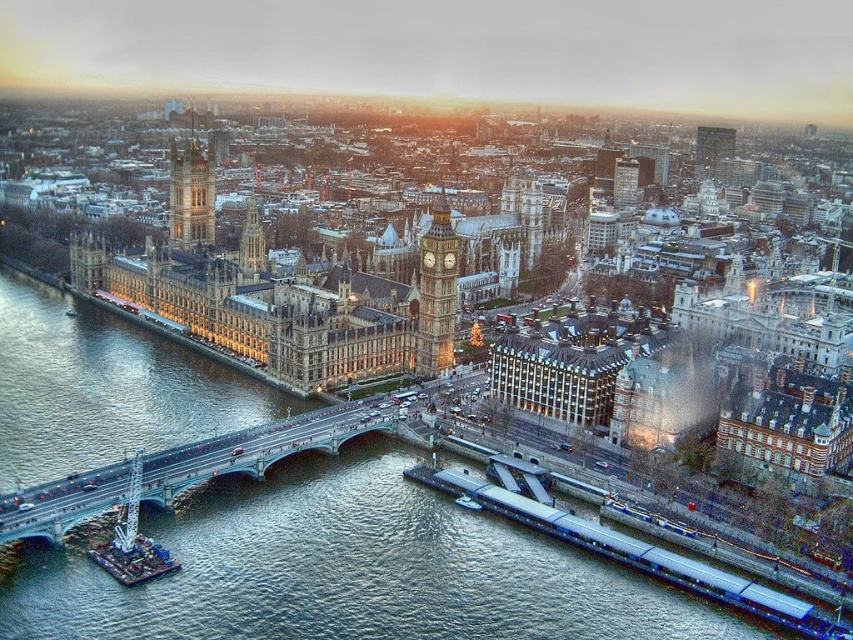
You are a tourist standing at the center of the image, looking towards the Palace of Westminster. Which direction should you turn to see the green metallic bridge at lower left?

The green metallic bridge at lower left is located at coordinates (259, 448), so you should turn to your left to see it.

You are standing on the green metallic bridge at lower left and want to take a photo of the golden stone clock tower at upper left. Since the bridge is between you and the clock tower, will the tower be fully visible in your photo?

The green metallic bridge at lower left is closer to the viewer than golden stone clock tower at upper left, so the tower will be partially blocked by the bridge in the photo.

You are standing at the point marked as point (259, 448) on the green metallic bridge at lower left. Looking towards the Palace of Westminster, which direction should you walk to reach the bridge? Answer with either north, south, east, or west.

The point (259, 448) is already on the green metallic bridge at lower left, so you are already on the bridge. Therefore, you don not need to walk in any direction to reach it.